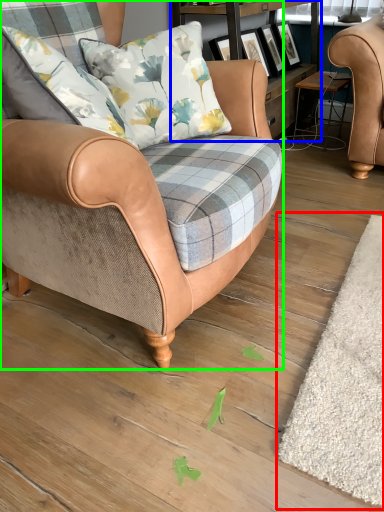
Question: Considering the real-world distances, which object is farthest from mat (highlighted by a red box)? shelf (highlighted by a blue box) or chair (highlighted by a green box)?

Choices:
 (A) shelf
 (B) chair

Answer: (A)